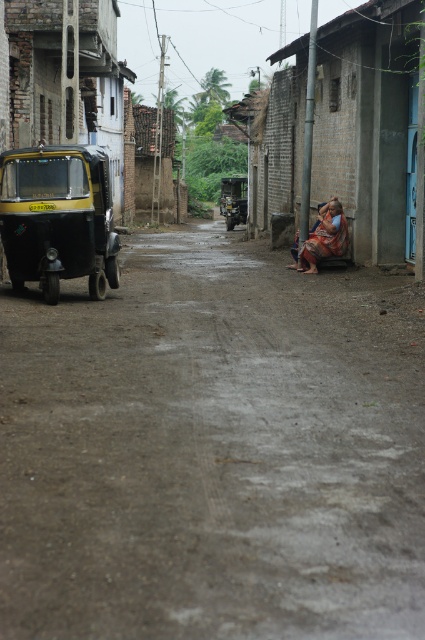
Between smooth concrete road at center and orange fabric cloth at center, which one has more height?

With more height is smooth concrete road at center.

Consider the image. Does smooth concrete road at center appear over orange fabric cloth at center?

No, smooth concrete road at center is not above orange fabric cloth at center.

Identify the location of smooth concrete road at center. The image size is (425, 640). (212, 451).

Who is more forward, (272, 141) or (17, 58)?

Positioned in front is point (17, 58).

Who is lower down, orange fabric bench at right or yellow-green plastic auto-rickshaw at left?

yellow-green plastic auto-rickshaw at left is below.

Which is in front, point (322, 28) or point (121, 198)?

Point (322, 28) is in front.

The image size is (425, 640). I want to click on orange fabric bench at right, so click(x=373, y=128).

Can you confirm if yellow matte auto-rickshaw at left is thinner than yellow-green plastic auto-rickshaw at left?

Result: Indeed, yellow matte auto-rickshaw at left has a lesser width compared to yellow-green plastic auto-rickshaw at left.

Between yellow matte auto-rickshaw at left and yellow-green plastic auto-rickshaw at left, which one has more height?

yellow-green plastic auto-rickshaw at left is taller.

Which is in front, point (78, 243) or point (39, 36)?

Point (78, 243) is in front.

Image resolution: width=425 pixels, height=640 pixels. Identify the location of yellow matte auto-rickshaw at left. (57, 218).